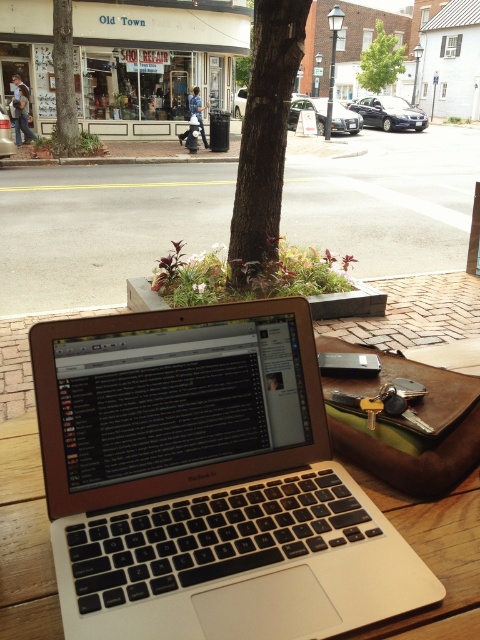
Question: Is silver metallic laptop at center bigger than metallic keys at center?

Choices:
 (A) no
 (B) yes

Answer: (B)

Question: Does silver metallic laptop at center appear on the right side of metallic keys at center?

Choices:
 (A) yes
 (B) no

Answer: (B)

Question: Which point is farther from the camera taking this photo?

Choices:
 (A) (465, 426)
 (B) (294, 458)

Answer: (A)

Question: Which point appears closest to the camera in this image?

Choices:
 (A) (418, 474)
 (B) (242, 435)

Answer: (B)

Question: Does silver metallic laptop at center have a smaller size compared to metallic keys at center?

Choices:
 (A) no
 (B) yes

Answer: (A)

Question: Which object appears closest to the camera in this image?

Choices:
 (A) silver metallic laptop at center
 (B) metallic keys at center

Answer: (A)